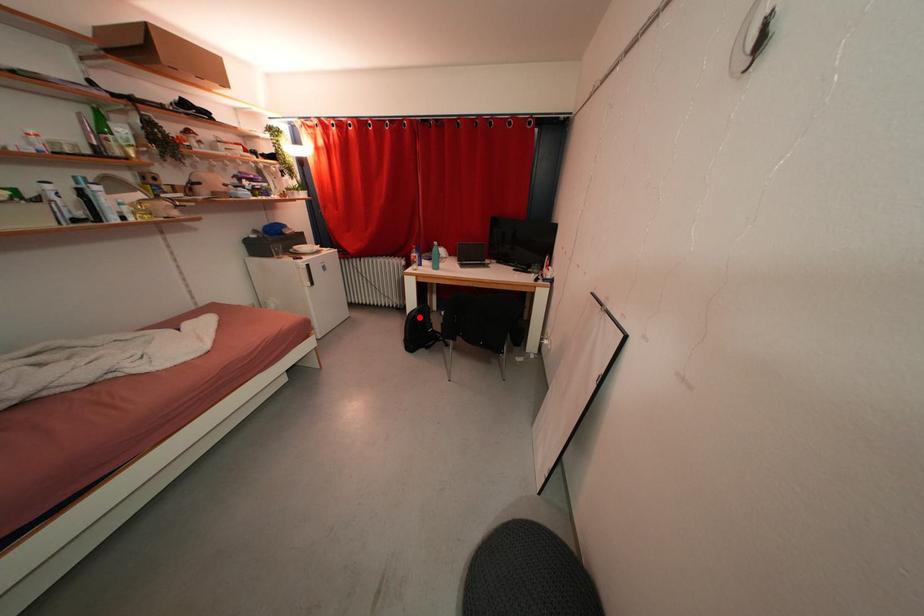
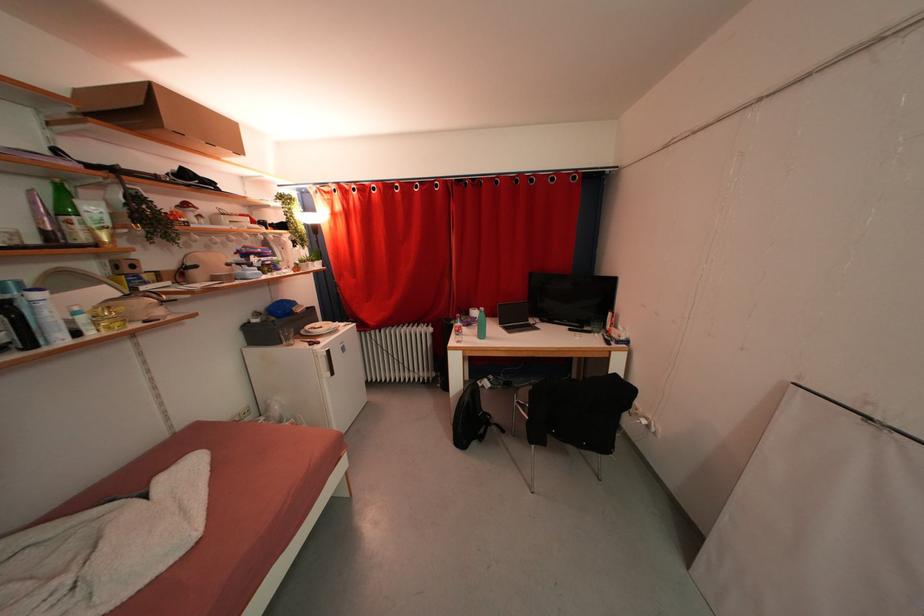
The point at the highlighted location is marked in the first image. Where is the corresponding point in the second image?

(472, 403)